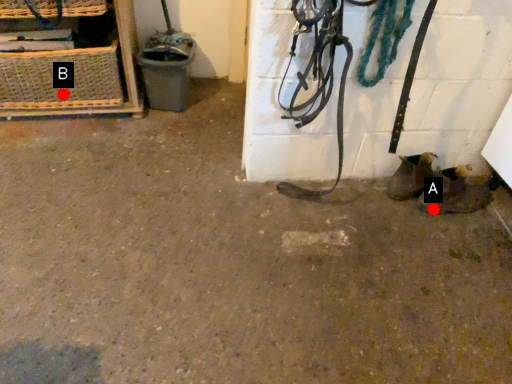
Question: Two points are circled on the image, labeled by A and B beside each circle. Which point appears farthest from the camera in this image?

Choices:
 (A) A is further
 (B) B is further

Answer: (B)